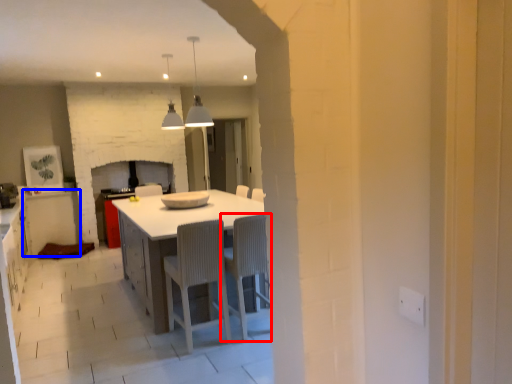
Question: Which object appears farthest to the camera in this image, chair (highlighted by a red box) or cabinetry (highlighted by a blue box)?

Choices:
 (A) chair
 (B) cabinetry

Answer: (B)